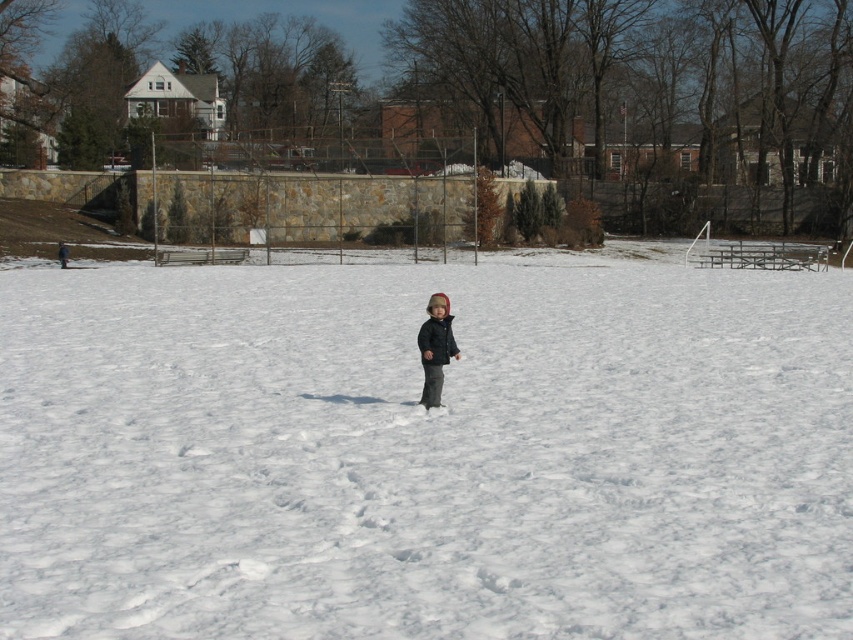
Between point (86, 451) and point (457, 348), which one is positioned in front?

Positioned in front is point (86, 451).

Where is `white fluffy snow at center`? white fluffy snow at center is located at coordinates (425, 452).

This screenshot has height=640, width=853. Identify the location of white fluffy snow at center. (425, 452).

Between point (299, 308) and point (438, 330), which one is positioned behind?

The point (299, 308) is behind.

Between point (778, 636) and point (431, 294), which one is positioned behind?

The point (431, 294) is behind.

Find the location of a particular element. The image size is (853, 640). white fluffy snow at center is located at coordinates (425, 452).

Can you confirm if dark gray fleece jacket at center is smaller than dark blue matte jacket at center?

No, dark gray fleece jacket at center is not smaller than dark blue matte jacket at center.

Locate an element on the screen. dark gray fleece jacket at center is located at coordinates (434, 348).